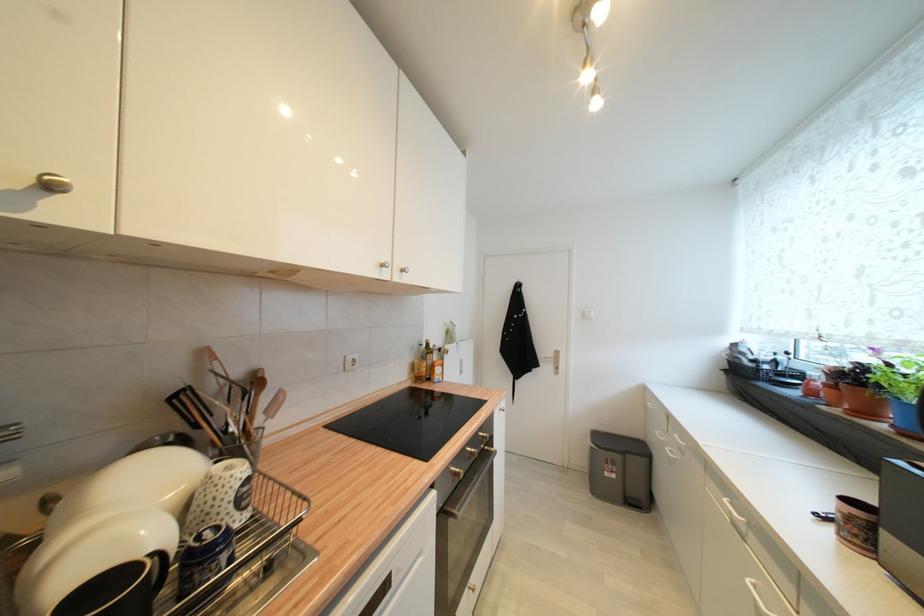
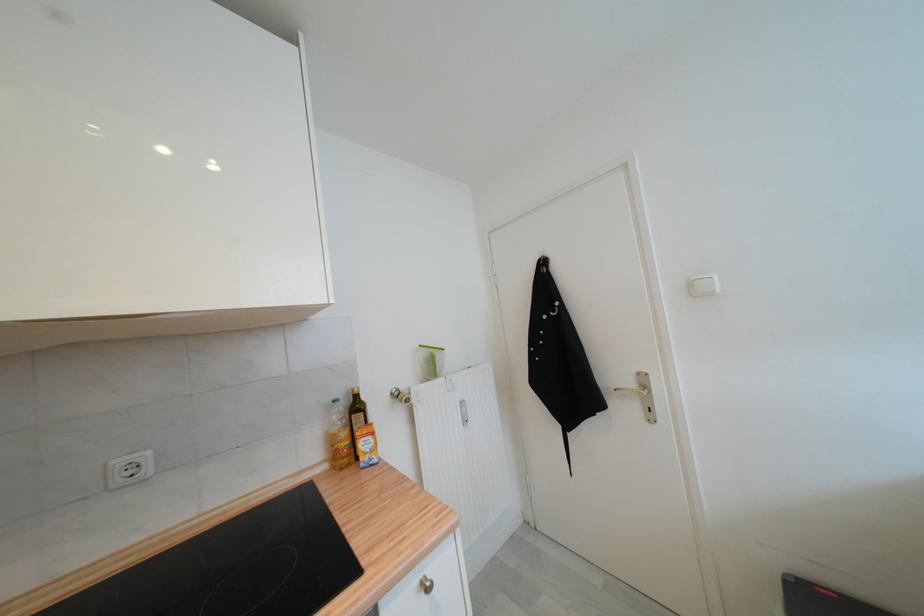
In the second image, find the point that corresponds to point 556,358 in the first image.

(637, 386)